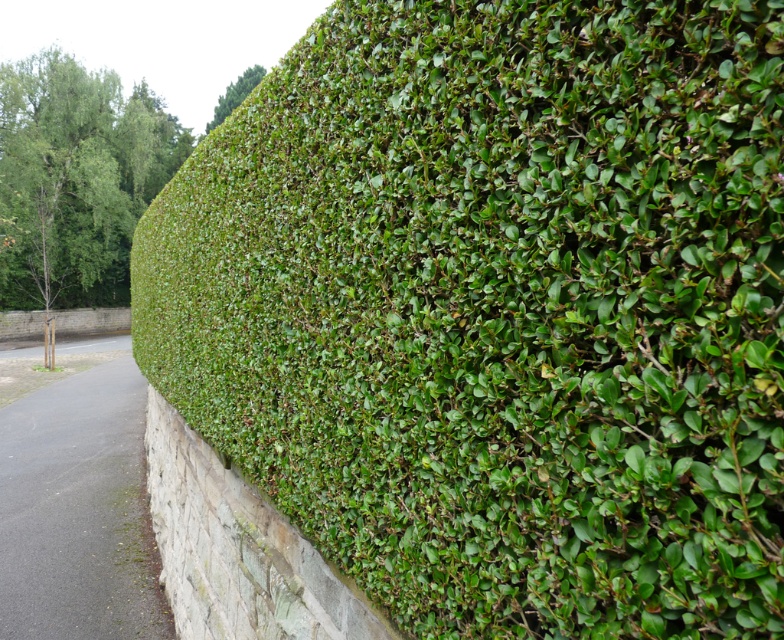
You are a landscape architect designing a garden pathway. You notice a green leafy tree at upper left and a green leafy hedge at upper left in the scene. Which of these two elements has a greater width?

The green leafy tree at upper left has a greater width than the green leafy hedge at upper left according to the description.

You are a gardener planning to trim both the green leafy tree at upper left and the green leafy hedge at upper left. Which one requires more time to trim based on their sizes?

The green leafy tree at upper left requires more time to trim because it is bigger than the green leafy hedge at upper left.